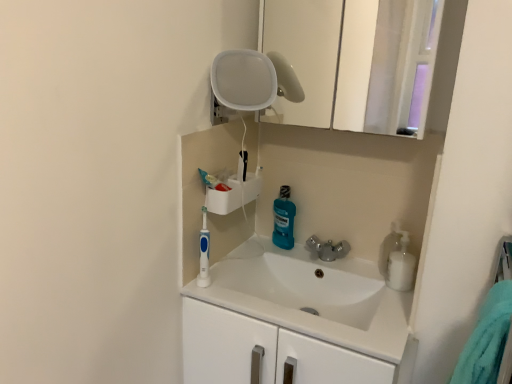
Find the location of a particular element. The image size is (512, 384). free space to the left of white glossy bottle at right, the 2th cleaning product positioned from the left is located at coordinates click(354, 278).